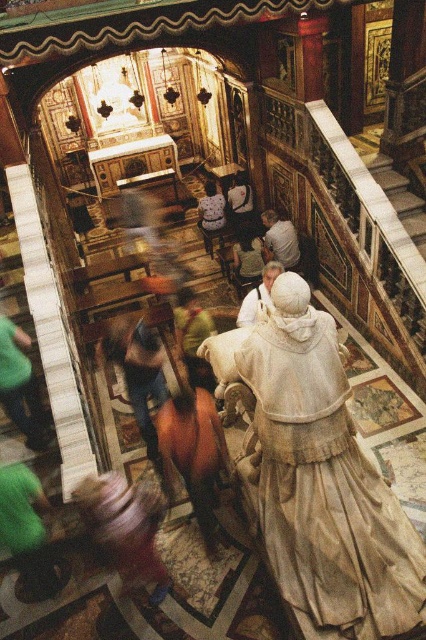
Question: Does light beige fabric at center have a lesser width compared to light blue fabric dress at center?

Choices:
 (A) yes
 (B) no

Answer: (B)

Question: Which object is farther from the camera taking this photo?

Choices:
 (A) white marble statue at center
 (B) light blue fabric dress at center
 (C) green fabric shirt at center

Answer: (B)

Question: Can you confirm if white marble statue at center is positioned below light beige fabric statue at center?

Choices:
 (A) no
 (B) yes

Answer: (B)

Question: Among these objects, which one is nearest to the camera?

Choices:
 (A) light beige fabric dress at center
 (B) light beige fabric at center

Answer: (A)

Question: Does green fabric shirt at left have a greater width compared to green fabric shirt at center?

Choices:
 (A) no
 (B) yes

Answer: (A)

Question: Which object is closer to the camera taking this photo?

Choices:
 (A) light beige fabric statue at center
 (B) white marble statue at center

Answer: (B)